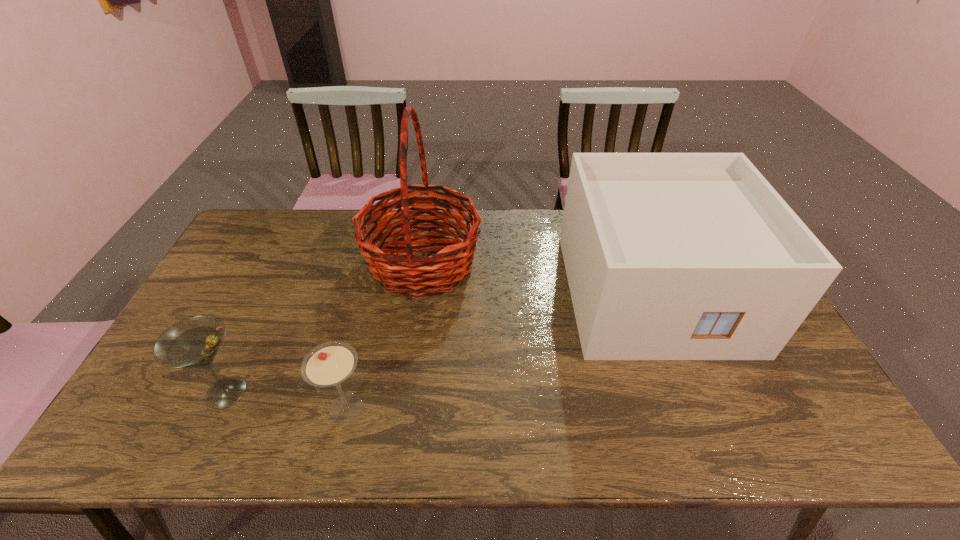
Locate an element on the screen. This screenshot has height=540, width=960. free point between the rightmost object and the leftmost object is located at coordinates (440, 342).

Where is `vacant region between the second tallest object and the shortest object`? The image size is (960, 540). vacant region between the second tallest object and the shortest object is located at coordinates (499, 350).

Where is `empty location between the third shortest object and the right martini`? The image size is (960, 540). empty location between the third shortest object and the right martini is located at coordinates (499, 350).

Locate an element on the screen. object that is the second nearest to the taller martini is located at coordinates (406, 273).

Point out which object is positioned as the second nearest to the right martini. Please provide its 2D coordinates. Your answer should be formatted as a tuple, i.e. [(x, y)], where the tuple contains the x and y coordinates of a point satisfying the conditions above.

[(406, 273)]

You are a GUI agent. You are given a task and a screenshot of the screen. Output one action in this format:
    pyautogui.click(x=<x>, y=<y>)
    Task: Click on the vacant region that satisfies the following two spatial constraints: 1. on the front side of the right martini; 2. on the left side of the taller martini
    This screenshot has width=960, height=540.
    Given the screenshot: What is the action you would take?
    pyautogui.click(x=220, y=408)